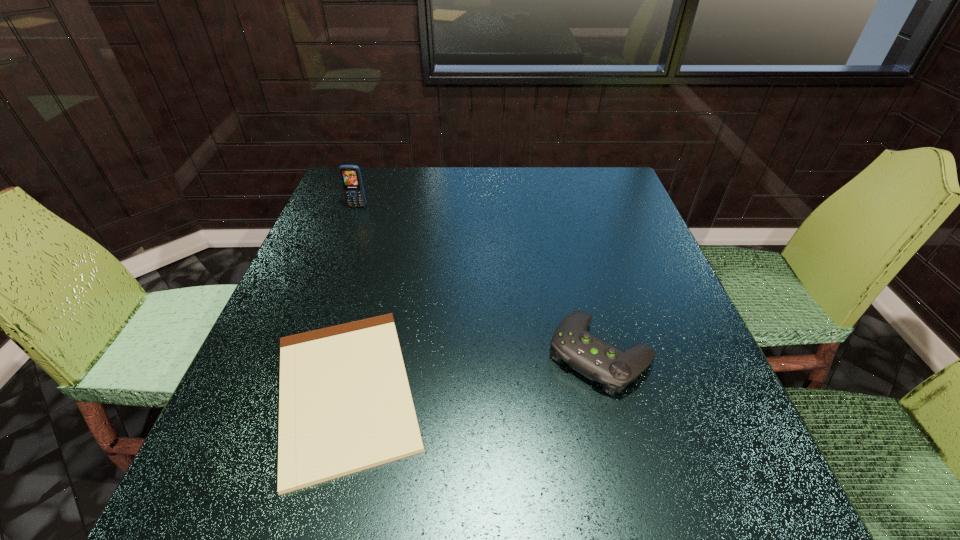
Locate an element on the screen. The width and height of the screenshot is (960, 540). cellular telephone that is at the left edge is located at coordinates (350, 175).

Where is `clipboard present at the left edge`? The width and height of the screenshot is (960, 540). clipboard present at the left edge is located at coordinates click(x=345, y=405).

The width and height of the screenshot is (960, 540). I want to click on object positioned at the right edge, so click(x=586, y=353).

This screenshot has width=960, height=540. Identify the location of object located in the far left corner section of the desktop. [x=350, y=175].

The height and width of the screenshot is (540, 960). I want to click on object located at the near left corner, so click(x=345, y=405).

The height and width of the screenshot is (540, 960). I want to click on vacant region at the far edge of the desktop, so pos(429,192).

Image resolution: width=960 pixels, height=540 pixels. Find the location of `vacant space at the near edge of the desktop`. vacant space at the near edge of the desktop is located at coordinates (431, 511).

Identify the location of vacant space at the left edge. This screenshot has width=960, height=540. (357, 272).

Locate an element on the screen. The height and width of the screenshot is (540, 960). vacant point at the right edge is located at coordinates (642, 281).

You are a GUI agent. You are given a task and a screenshot of the screen. Output one action in this format:
    pyautogui.click(x=<x>, y=<y>)
    Task: Click on the vacant region at the far right corner of the desktop
    The width and height of the screenshot is (960, 540).
    Given the screenshot: What is the action you would take?
    pos(604,176)